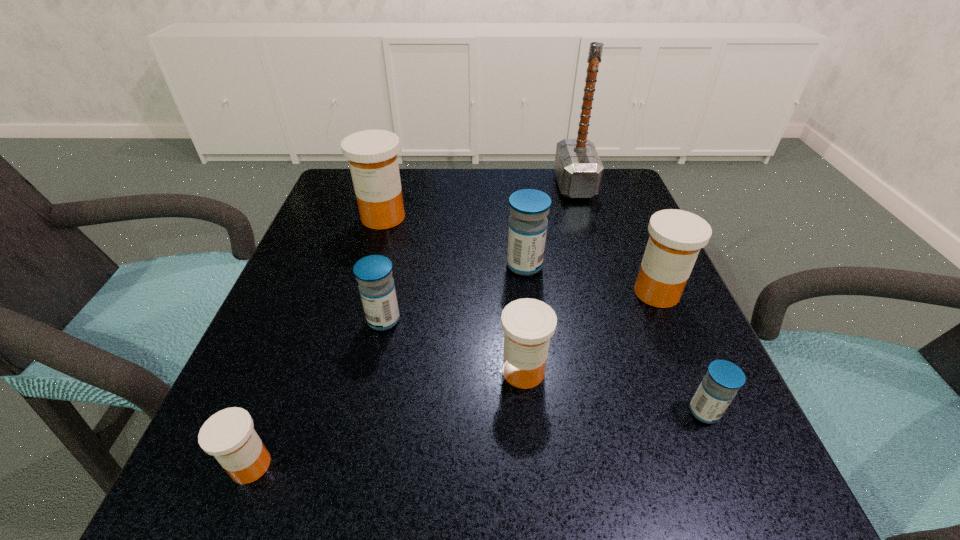
This screenshot has height=540, width=960. Find the location of `free spot that satisfies the following two spatial constraints: 1. on the label of the sixth farthest object; 2. on the right side of the smallest blue medicine`. free spot that satisfies the following two spatial constraints: 1. on the label of the sixth farthest object; 2. on the right side of the smallest blue medicine is located at coordinates (527, 411).